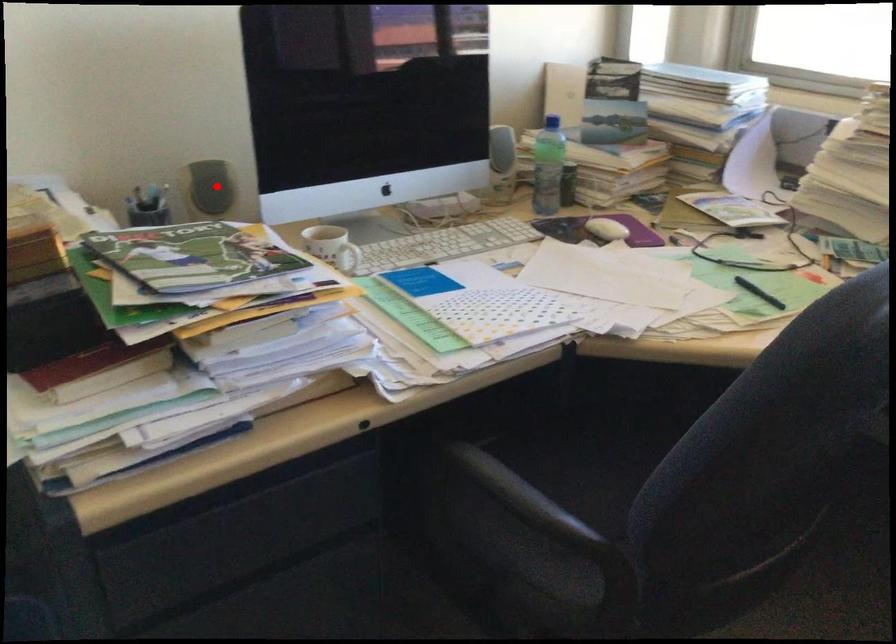
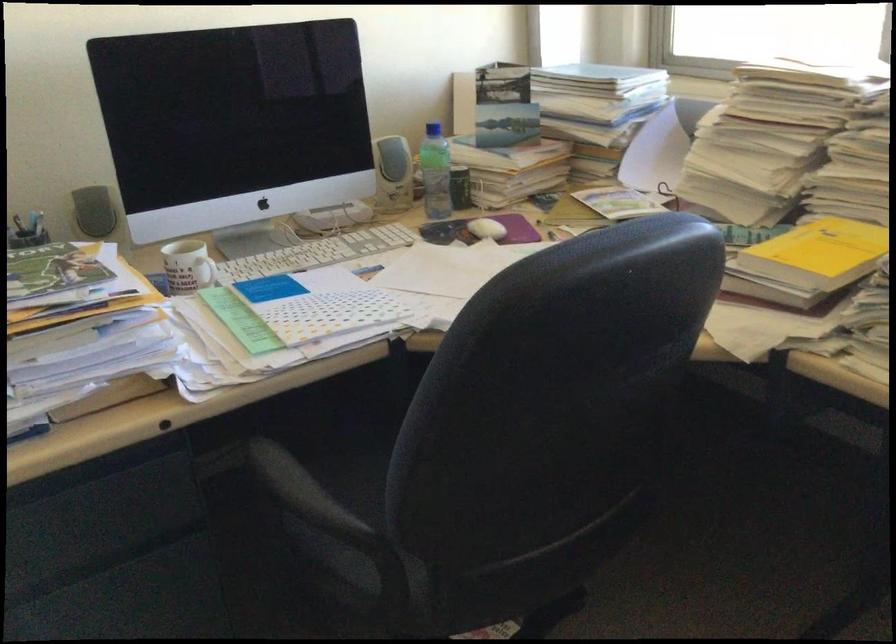
The point at the highlighted location is marked in the first image. Where is the corresponding point in the second image?

(93, 211)